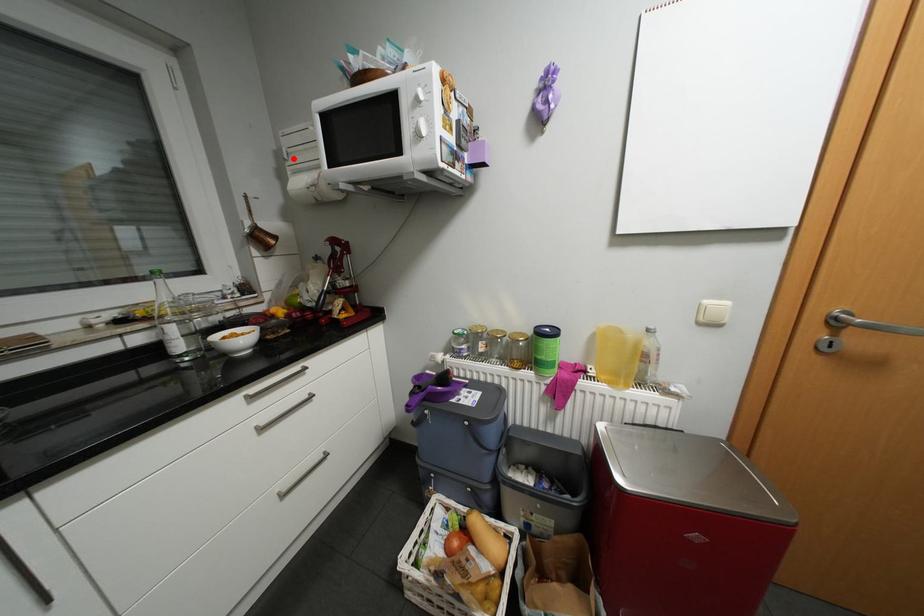
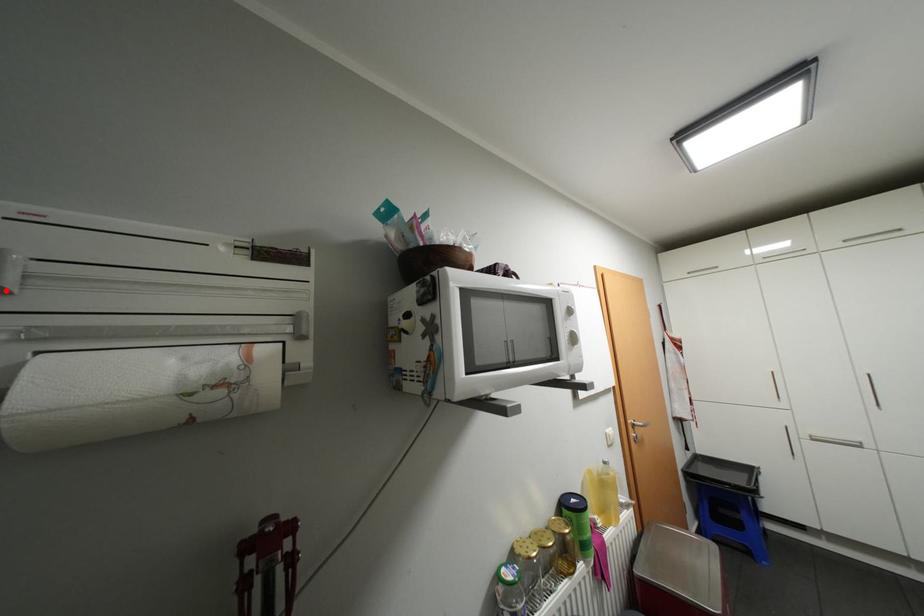
I am providing you with two images of the same scene from different viewpoints. A red point is marked on the first image and another point is marked on the second image. Do the highlighted points in image1 and image2 indicate the same real-world spot?

Yes